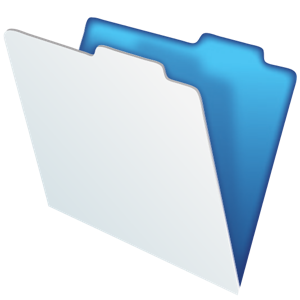
This screenshot has height=300, width=300. Identify the location of blue inner folder. (258, 108).